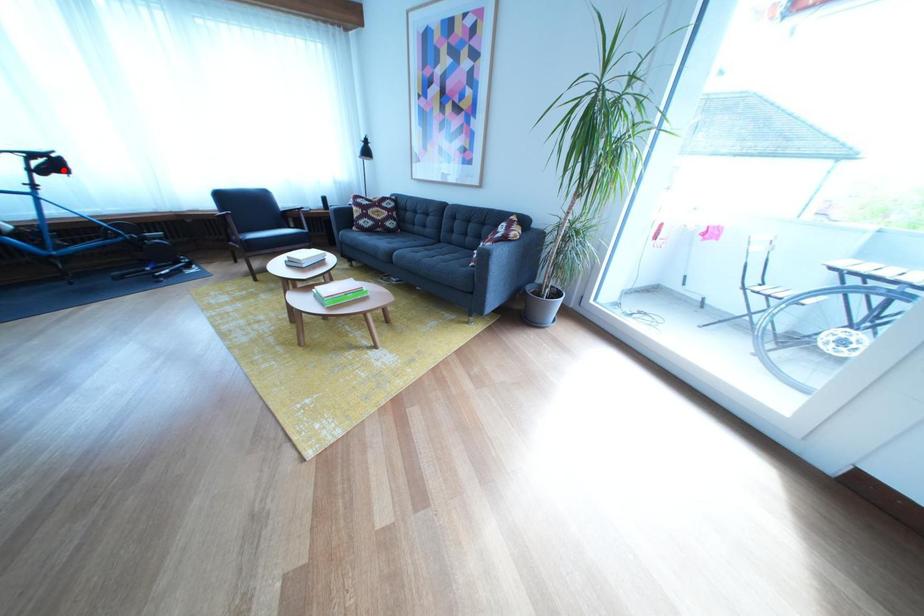
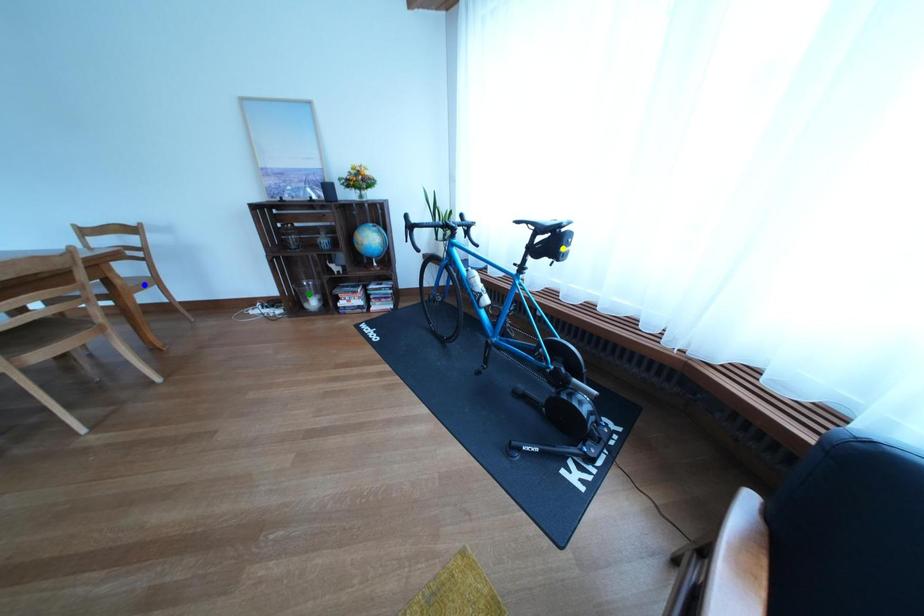
Question: I am providing you with two images of the same scene from different viewpoints. A red point is marked on the first image. You are given multiple points on the second image. Can you choose the point in image 2 that corresponds to the point in image 1?

Choices:
 (A) green point
 (B) blue point
 (C) yellow point

Answer: (C)